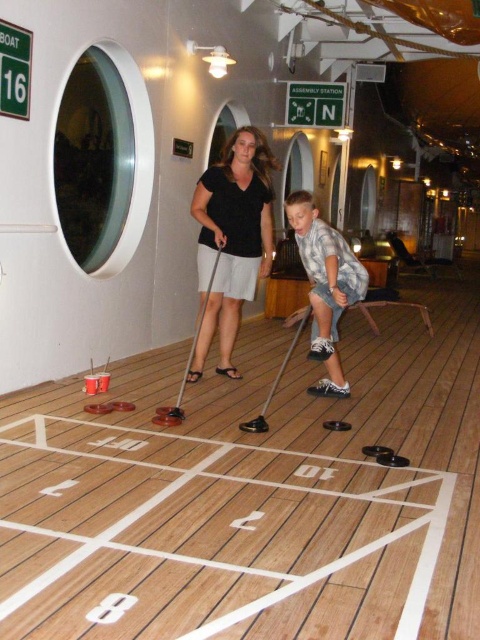
Can you confirm if black matte shirt at center is taller than checkered fabric shirt at center?

Yes.

The width and height of the screenshot is (480, 640). Describe the element at coordinates (231, 240) in the screenshot. I see `black matte shirt at center` at that location.

Identify the location of black matte shirt at center. (231, 240).